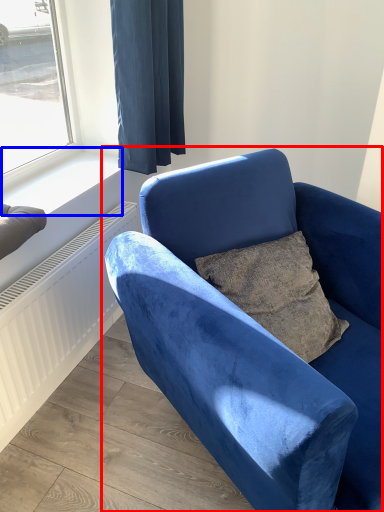
Question: Which point is closer to the camera, chair (highlighted by a red box) or window sill (highlighted by a blue box)?

Choices:
 (A) chair
 (B) window sill

Answer: (A)